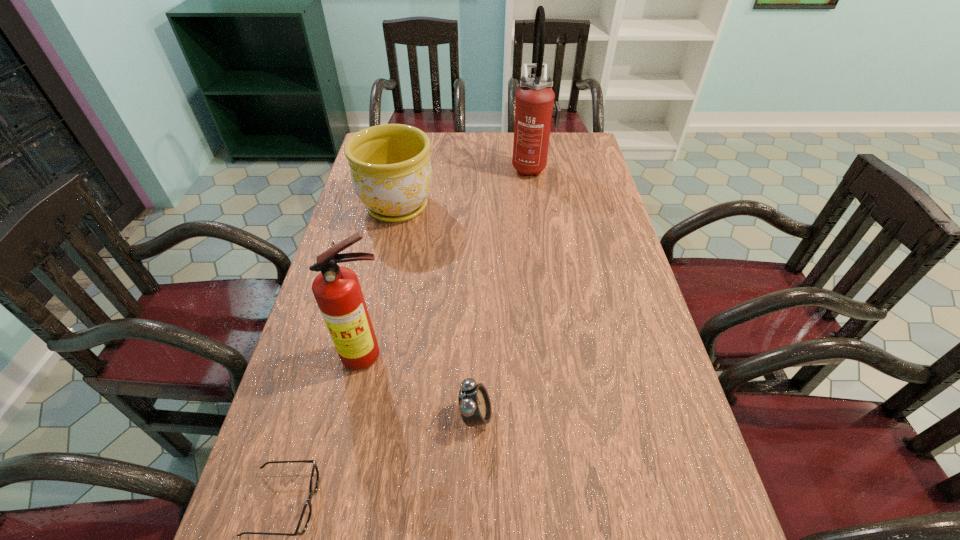
The width and height of the screenshot is (960, 540). In the image, there is a desktop. In order to click on vacant space at the far right corner in this screenshot , I will do `click(598, 165)`.

I want to click on vacant area that lies between the second farthest object and the rightmost object, so click(x=465, y=186).

Where is `free space between the nearer fire extinguisher and the second object from right to left`? free space between the nearer fire extinguisher and the second object from right to left is located at coordinates (421, 385).

Image resolution: width=960 pixels, height=540 pixels. Find the location of `blank region between the second tallest object and the alarm clock`. blank region between the second tallest object and the alarm clock is located at coordinates (421, 385).

At what (x,y) coordinates should I click in order to perform the action: click on vacant point located between the farther fire extinguisher and the fourth object from left to right. Please return your answer as a coordinate pair (x, y). Looking at the image, I should click on (503, 291).

In order to click on vacant region between the third farthest object and the farthest object in this screenshot , I will do `click(449, 260)`.

You are a GUI agent. You are given a task and a screenshot of the screen. Output one action in this format:
    pyautogui.click(x=<x>, y=<y>)
    Task: Click on the vacant area between the second object from right to left and the farther fire extinguisher
    This screenshot has height=540, width=960.
    Given the screenshot: What is the action you would take?
    pyautogui.click(x=503, y=291)

What are the coordinates of `free space between the fourth object from left to right and the farthest object` in the screenshot? It's located at (503, 291).

This screenshot has height=540, width=960. What are the coordinates of `free space between the left fire extinguisher and the fourth farthest object` in the screenshot? It's located at (421, 385).

Identify the location of object identified as the second closest to the nearest object. The width and height of the screenshot is (960, 540). (474, 403).